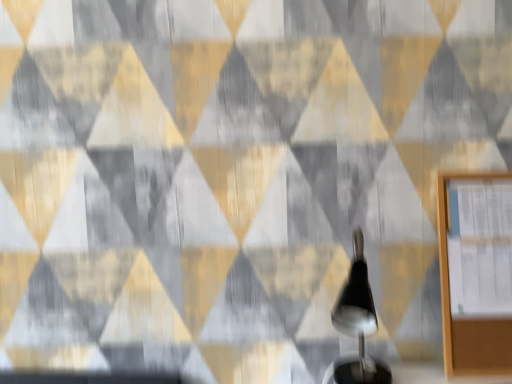
You are a GUI agent. You are given a task and a screenshot of the screen. Output one action in this format:
    pyautogui.click(x=<x>, y=<y>)
    Task: Click on the black glossy table lamp at center
    This screenshot has width=512, height=384.
    Given the screenshot: What is the action you would take?
    pos(357,322)

Describe the element at coordinates (357, 322) in the screenshot. I see `black glossy table lamp at center` at that location.

Identify the location of black glossy table lamp at center. (357, 322).